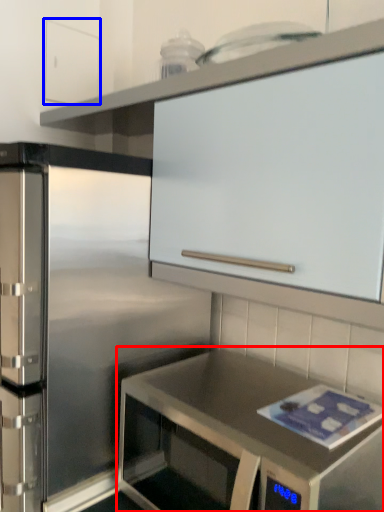
Question: Among these objects, which one is nearest to the camera, countertop (highlighted by a red box) or cabinetry (highlighted by a blue box)?

Choices:
 (A) countertop
 (B) cabinetry

Answer: (A)